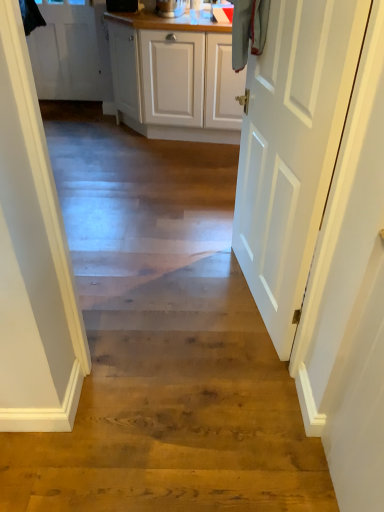
Question: Is white matte door at upper left, which is the second door in bottom-to-top order, to the left of white matte door at right, which ranks as the second door in left-to-right order, from the viewer's perspective?

Choices:
 (A) yes
 (B) no

Answer: (A)

Question: Is white matte door at upper left, marked as the first door in a back-to-front arrangement, outside white matte door at right, acting as the second door starting from the back?

Choices:
 (A) yes
 (B) no

Answer: (A)

Question: Does white matte door at upper left, which ranks as the first door in top-to-bottom order, lie behind white matte door at right, the first door ordered from the bottom?

Choices:
 (A) yes
 (B) no

Answer: (A)

Question: From the image's perspective, is white matte door at upper left, which is counted as the 2th door, starting from the right, above white matte door at right, acting as the second door starting from the back?

Choices:
 (A) no
 (B) yes

Answer: (B)

Question: From a real-world perspective, is white matte door at upper left, arranged as the second door when viewed from the front, over white matte door at right, the 1th door viewed from the front?

Choices:
 (A) no
 (B) yes

Answer: (A)

Question: Considering the relative sizes of white matte door at upper left, which is counted as the 2th door, starting from the right, and white matte door at right, which is the 1th door in right-to-left order, in the image provided, is white matte door at upper left, which is counted as the 2th door, starting from the right, wider than white matte door at right, which is the 1th door in right-to-left order,?

Choices:
 (A) no
 (B) yes

Answer: (A)

Question: Is white matte door at right, acting as the second door starting from the back, in front of white matte door at upper left, which is the second door in bottom-to-top order?

Choices:
 (A) no
 (B) yes

Answer: (B)

Question: Could you tell me if white matte door at right, acting as the second door starting from the back, is facing white matte door at upper left, which is counted as the 2th door, starting from the right?

Choices:
 (A) no
 (B) yes

Answer: (A)

Question: Does white matte door at right, which is the 1th door in right-to-left order, have a lesser width compared to white matte door at upper left, marked as the first door in a back-to-front arrangement?

Choices:
 (A) yes
 (B) no

Answer: (B)

Question: Considering the relative sizes of white matte door at right, which ranks as the second door in left-to-right order, and white matte door at upper left, marked as the first door in a back-to-front arrangement, in the image provided, is white matte door at right, which ranks as the second door in left-to-right order, bigger than white matte door at upper left, marked as the first door in a back-to-front arrangement,?

Choices:
 (A) yes
 (B) no

Answer: (A)

Question: Is white matte door at right, which appears as the second door when viewed from the top, surrounding white matte door at upper left, which ranks as the first door in top-to-bottom order?

Choices:
 (A) no
 (B) yes

Answer: (A)

Question: Is white matte door at right, which ranks as the second door in left-to-right order, not inside white matte door at upper left, which is the second door in bottom-to-top order?

Choices:
 (A) yes
 (B) no

Answer: (A)

Question: From the image's perspective, relative to white matte door at upper left, which ranks as the first door in top-to-bottom order, is white matte door at right, acting as the second door starting from the back, above or below?

Choices:
 (A) above
 (B) below

Answer: (B)